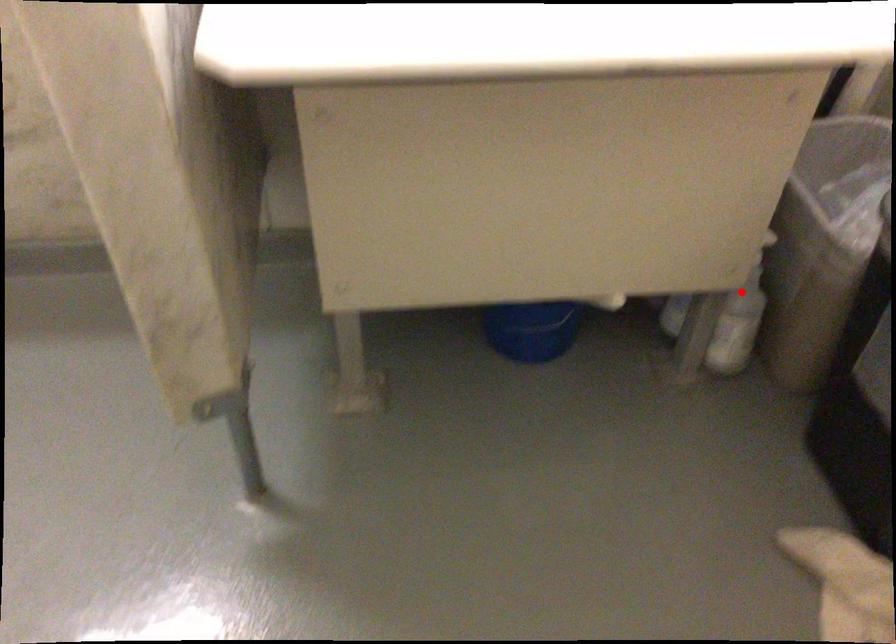
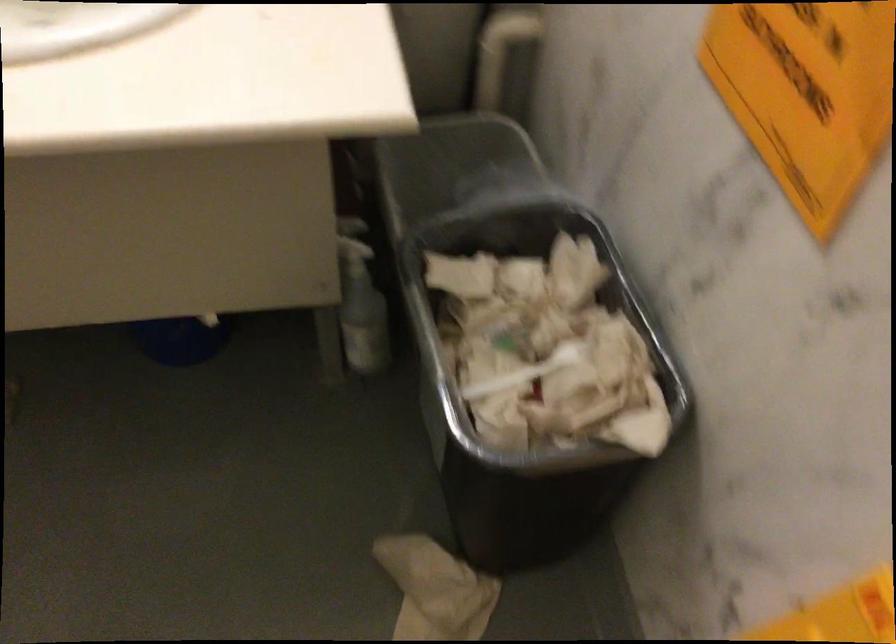
In the second image, find the point that corresponds to the highlighted location in the first image.

(360, 303)